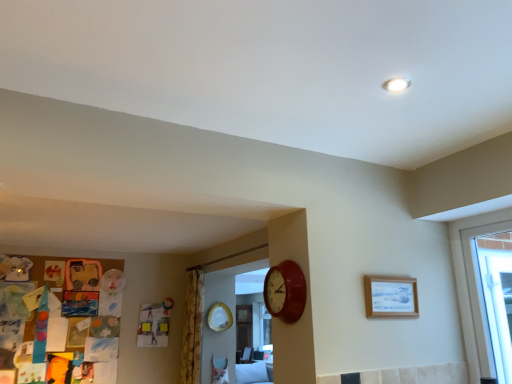
Question: Can you confirm if yellow floral fabric curtain at center is bigger than matte red clock at center?

Choices:
 (A) no
 (B) yes

Answer: (B)

Question: From the image's perspective, is yellow floral fabric curtain at center located above matte red clock at center?

Choices:
 (A) yes
 (B) no

Answer: (B)

Question: Is there a large distance between yellow floral fabric curtain at center and matte red clock at center?

Choices:
 (A) no
 (B) yes

Answer: (B)

Question: Is the depth of yellow floral fabric curtain at center less than that of matte red clock at center?

Choices:
 (A) no
 (B) yes

Answer: (A)

Question: Would you say yellow floral fabric curtain at center contains matte red clock at center?

Choices:
 (A) no
 (B) yes

Answer: (A)

Question: Is point (287, 261) closer or farther from the camera than point (194, 375)?

Choices:
 (A) closer
 (B) farther

Answer: (A)

Question: Considering their positions, is matte red clock at center located in front of or behind yellow floral fabric curtain at center?

Choices:
 (A) front
 (B) behind

Answer: (A)

Question: From a real-world perspective, is matte red clock at center positioned above or below yellow floral fabric curtain at center?

Choices:
 (A) above
 (B) below

Answer: (A)

Question: Which is correct: matte red clock at center is inside yellow floral fabric curtain at center, or outside of it?

Choices:
 (A) outside
 (B) inside

Answer: (A)

Question: Based on their positions, is matte red clock at center located to the left or right of wooden picture frame at upper right?

Choices:
 (A) left
 (B) right

Answer: (A)

Question: Is matte red clock at center wider or thinner than wooden picture frame at upper right?

Choices:
 (A) thin
 (B) wide

Answer: (B)

Question: From the image's perspective, is matte red clock at center located above or below wooden picture frame at upper right?

Choices:
 (A) below
 (B) above

Answer: (B)

Question: In terms of height, does matte red clock at center look taller or shorter compared to wooden picture frame at upper right?

Choices:
 (A) tall
 (B) short

Answer: (A)

Question: Relative to yellow floral fabric curtain at center, is wooden picture frame at upper right in front or behind?

Choices:
 (A) behind
 (B) front

Answer: (B)

Question: Considering the positions of point (387, 286) and point (186, 352), is point (387, 286) closer or farther from the camera than point (186, 352)?

Choices:
 (A) farther
 (B) closer

Answer: (B)